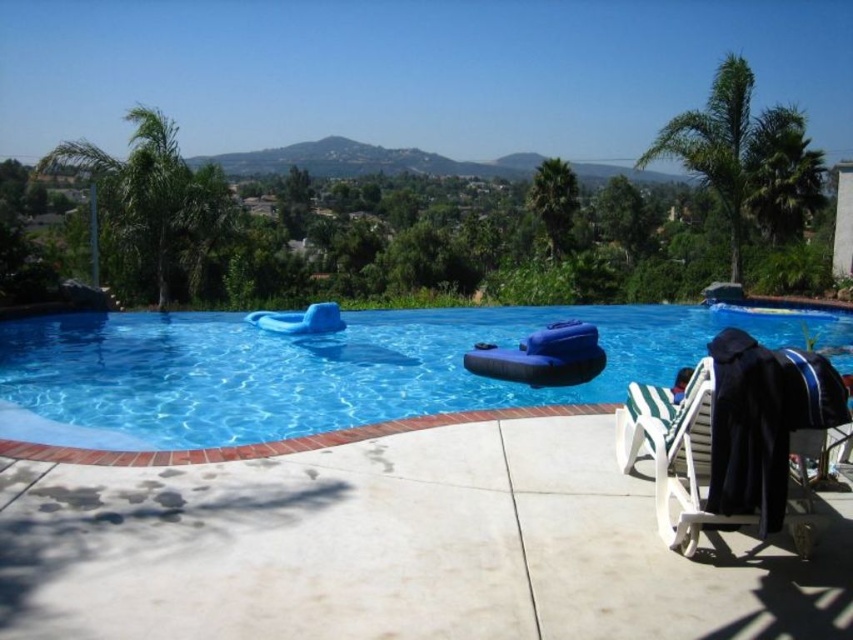
Question: Which point appears farthest from the camera in this image?

Choices:
 (A) (554, 184)
 (B) (173, 220)
 (C) (648, 362)
 (D) (746, 141)

Answer: (A)

Question: Can you confirm if blue rubber float at center is wider than green leafy palm tree at upper right?

Choices:
 (A) yes
 (B) no

Answer: (A)

Question: Is green leafy palm tree at upper right below green leafy palm tree at upper left?

Choices:
 (A) yes
 (B) no

Answer: (A)

Question: Considering the relative positions of green leafy palm tree at upper right and green leafy palm tree at upper left in the image provided, where is green leafy palm tree at upper right located with respect to green leafy palm tree at upper left?

Choices:
 (A) below
 (B) above

Answer: (A)

Question: Which point is farther to the camera?

Choices:
 (A) green leafy palm tree at upper left
 (B) green leafy palm tree at upper right
 (C) green leafy palm tree at upper center

Answer: (C)

Question: Which of the following is the farthest from the observer?

Choices:
 (A) green leafy palm tree at upper right
 (B) green leafy palm tree at upper left
 (C) green leafy palm tree at upper center

Answer: (C)